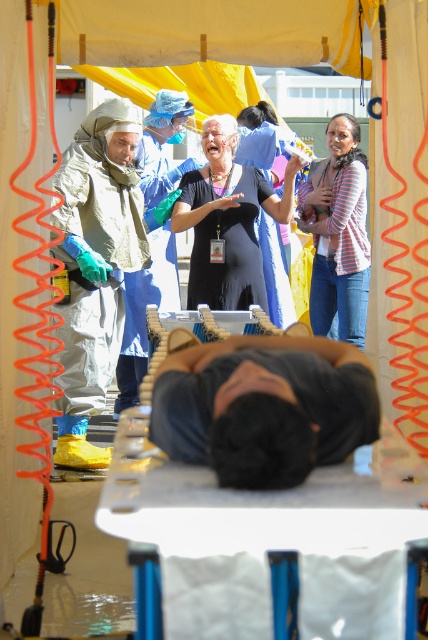
Between dark blue fabric at center and black matte dress at center, which one is positioned higher?

black matte dress at center

Can you confirm if dark blue fabric at center is thinner than black matte dress at center?

Correct, dark blue fabric at center's width is less than black matte dress at center's.

Describe the element at coordinates (264, 408) in the screenshot. I see `dark blue fabric at center` at that location.

This screenshot has width=428, height=640. In order to click on dark blue fabric at center in this screenshot , I will do `click(264, 408)`.

Between point (61, 451) and point (235, 241), which one is positioned in front?

Point (61, 451) is more forward.

This screenshot has width=428, height=640. What do you see at coordinates (95, 266) in the screenshot?
I see `matte hazmat suit at left` at bounding box center [95, 266].

Identify the location of matte hazmat suit at left. (95, 266).

Between matte hazmat suit at left and dark brown leather bag at center, which one is positioned lower?

matte hazmat suit at left

Is point (83, 467) positioned before point (162, 264)?

Yes, point (83, 467) is in front of point (162, 264).

From the picture: Measure the distance between matte hazmat suit at left and camera.

A distance of 20.25 feet exists between matte hazmat suit at left and camera.

This screenshot has width=428, height=640. Identify the location of matte hazmat suit at left. (95, 266).